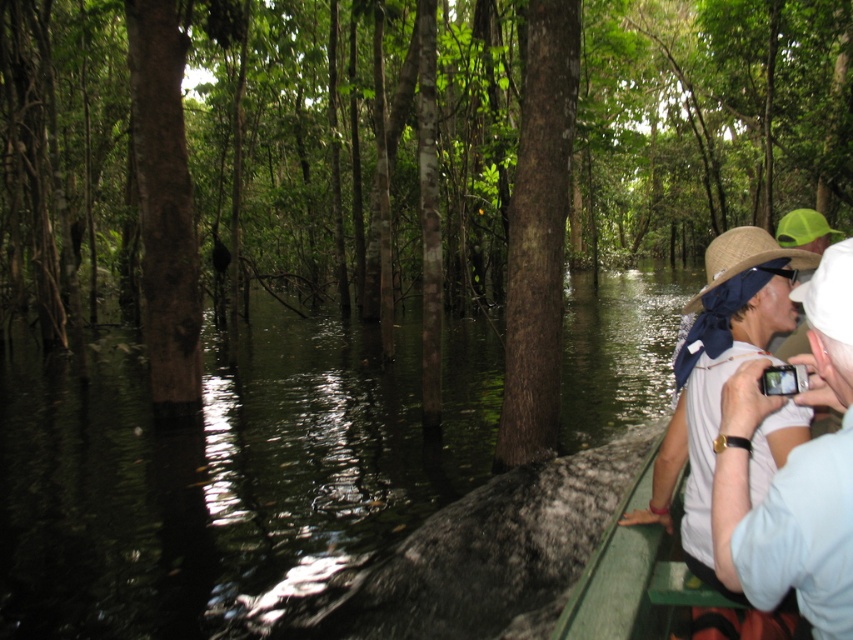
You are navigating a small boat through the flooded forest and want to pass between two points marked as point 1 at (785, 481) and point 2 at (561, 241). Which point should you steer towards first to ensure the closest approach to the viewer?

You should steer towards point 1 at (785, 481) first because it is closer to the viewer than point 2 at (561, 241), allowing for a closer approach.

You are navigating a flooded forest and need to place a 5 meter long rope between the light brown straw hat at right and the brown rough tree trunk at center. Will the rope be long enough to connect them?

The light brown straw hat at right and brown rough tree trunk at center are 4.57 meters apart from each other. Since the rope is 5 meters long, it will be long enough to connect them.

You are navigating a flooded forest and need to determine if the brown rough tree at center is taller than the white cotton shirt at right. Based on the scene description, can you confirm this?

Yes, the brown rough tree at center is taller than the white cotton shirt at right according to the description.